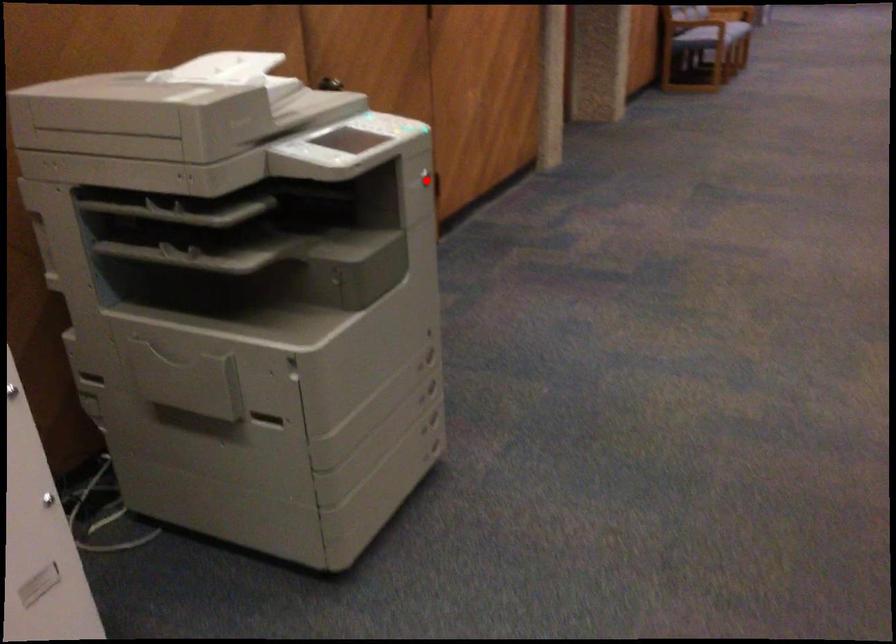
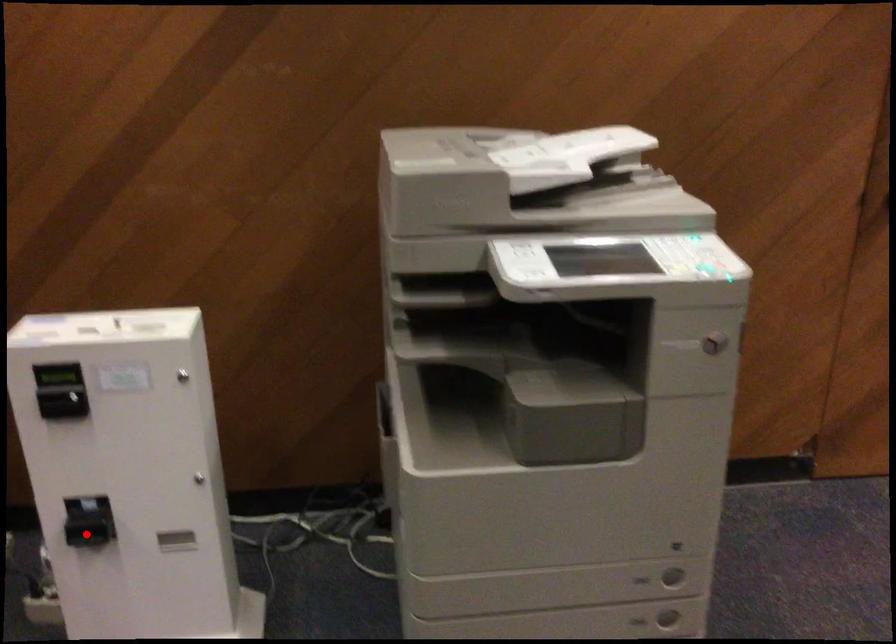
I am providing you with two images of the same scene from different viewpoints. A red point is marked on the first image and another point is marked on the second image. Do the highlighted points in image1 and image2 indicate the same real-world spot?

No